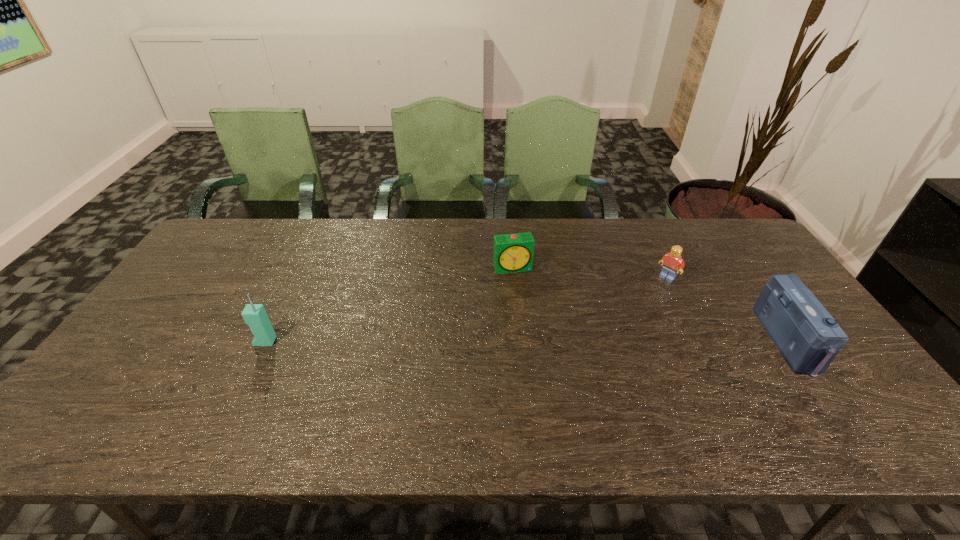
You are a GUI agent. You are given a task and a screenshot of the screen. Output one action in this format:
    pyautogui.click(x=<x>, y=<y>)
    Task: Click on the blank area located on the front-facing side of the second object from left to right
    This screenshot has height=540, width=960.
    Given the screenshot: What is the action you would take?
    pyautogui.click(x=550, y=376)

I want to click on vacant space situated on the front-facing side of the second object from left to right, so click(547, 367).

Where is `free space located 0.100m on the front-facing side of the second object from right to left`? The width and height of the screenshot is (960, 540). free space located 0.100m on the front-facing side of the second object from right to left is located at coordinates (645, 298).

Find the location of a particular element. vacant region located 0.220m on the front-facing side of the second object from right to left is located at coordinates (622, 319).

At what (x,y) coordinates should I click in order to perform the action: click on vacant region located 0.290m on the front-facing side of the second object from right to left. Please return your answer as a coordinate pair (x, y). The height and width of the screenshot is (540, 960). Looking at the image, I should click on (609, 332).

Locate an element on the screen. Image resolution: width=960 pixels, height=540 pixels. object that is positioned at the near edge is located at coordinates pyautogui.click(x=807, y=336).

The image size is (960, 540). In order to click on object located at the right edge in this screenshot , I will do `click(807, 336)`.

Identify the location of object located in the near right corner section of the desktop. The image size is (960, 540). (807, 336).

The image size is (960, 540). Find the location of `vacant space at the far edge`. vacant space at the far edge is located at coordinates (630, 243).

Find the location of a particular element. The width and height of the screenshot is (960, 540). free space at the near edge of the desktop is located at coordinates (577, 377).